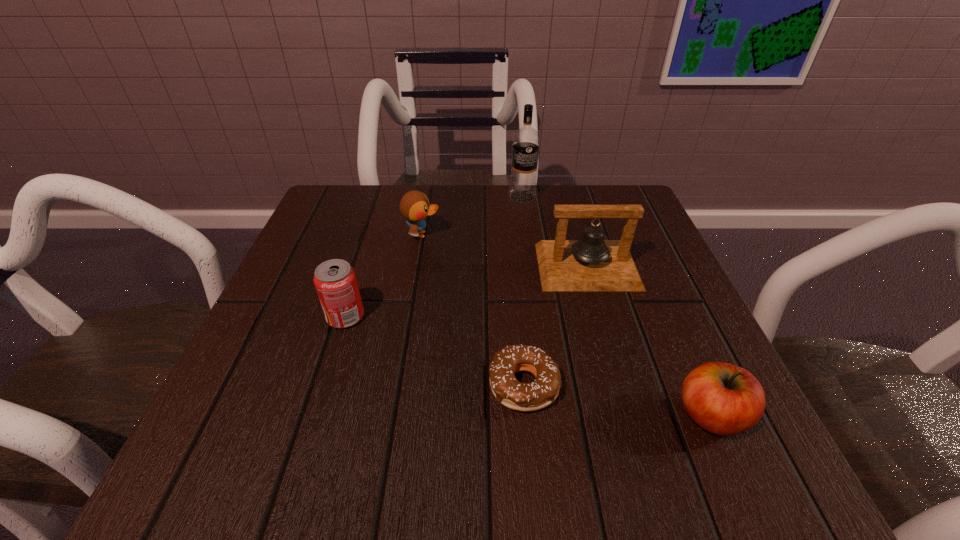
I want to click on the tallest object, so click(x=526, y=140).

Locate an element on the screen. The width and height of the screenshot is (960, 540). vodka is located at coordinates (526, 140).

The width and height of the screenshot is (960, 540). Identify the location of the fourth nearest object. (591, 263).

This screenshot has width=960, height=540. I want to click on the fifth shortest object, so click(x=591, y=263).

You are a GUI agent. You are given a task and a screenshot of the screen. Output one action in this format:
    pyautogui.click(x=<x>, y=<y>)
    Task: Click on the soda can
    Image resolution: width=960 pixels, height=540 pixels.
    Given the screenshot: What is the action you would take?
    pyautogui.click(x=335, y=280)

Identify the location of the third nearest object. This screenshot has height=540, width=960. pos(335,280).

I want to click on the fifth nearest object, so click(414, 206).

Where is `the fifth object from right to left`? This screenshot has width=960, height=540. the fifth object from right to left is located at coordinates (414, 206).

Find the location of `apple`. apple is located at coordinates (724, 399).

Where is `the shortest object`? The width and height of the screenshot is (960, 540). the shortest object is located at coordinates (526, 397).